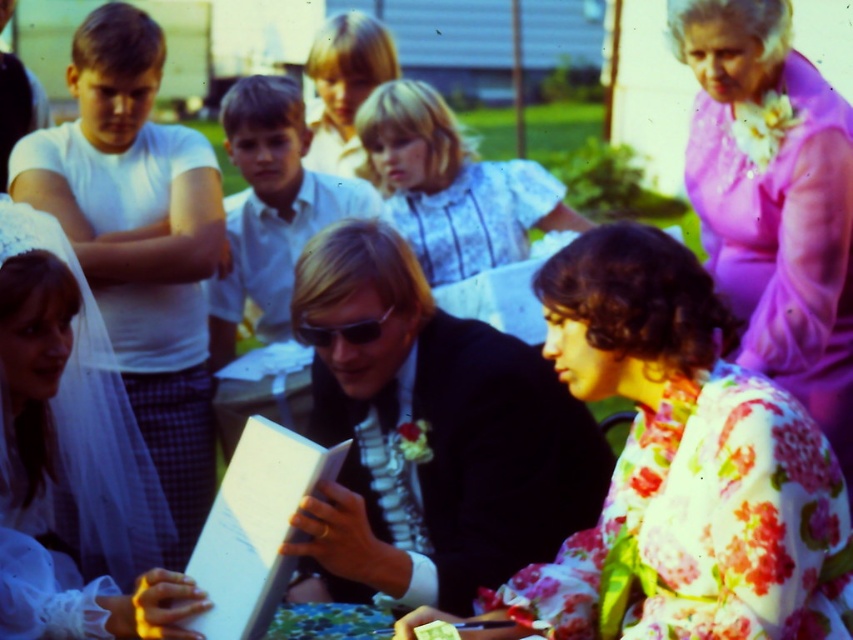
You are at a social event and see a point marked at coordinates (428, 433). Based on the scene description, which object is this point located on?

The point at coordinates (428, 433) is located on the floral silk dress at center.